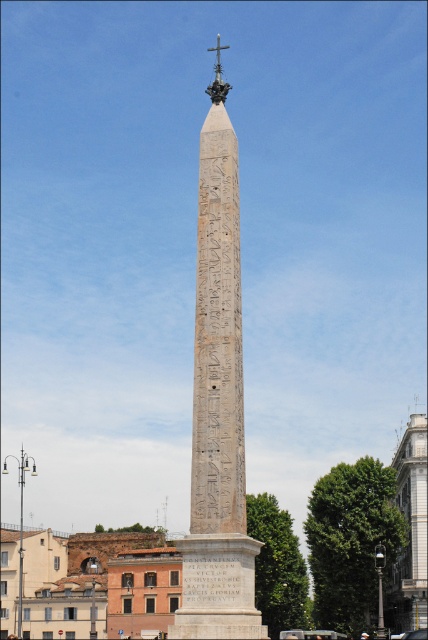
Which of these two, carved stone obelisk at center or white marble tower at right, stands shorter?

white marble tower at right is shorter.

Who is more forward, (x=229, y=493) or (x=425, y=451)?

Point (x=229, y=493)

Find the location of a particular element. The width and height of the screenshot is (428, 640). carved stone obelisk at center is located at coordinates (217, 404).